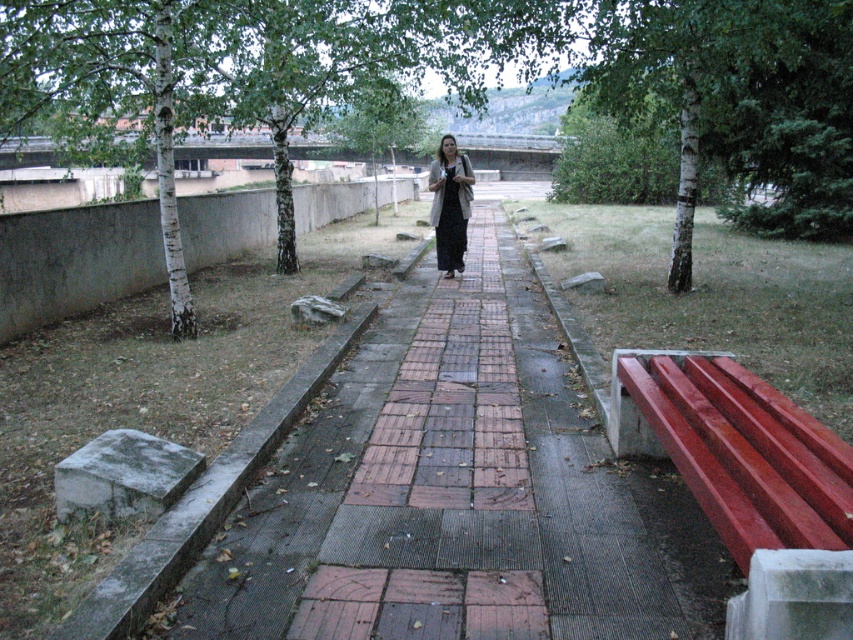
You are standing on the paved pathway and see the smooth red bench at right and the dark gray fabric dress at center. Which object is positioned lower in the image?

The smooth red bench at right is located below the dark gray fabric dress at center, so it is positioned lower in the image.

You are standing at the red bench with a white concrete base at the bottom right corner of the scene. You want to walk towards the grassy area on the left side of the path. Which point, point [489,493] or point [459,168], is closer to you as you start walking?

Point [489,493] is closer to the camera than point [459,168], so as you start walking from the red bench with a white concrete base at the bottom right corner towards the grassy area, point [489,493] will be closer to you initially.

You are designing a garden layout and need to place a new flower bed along the brick paved walkway at center. Considering the smooth red bench at right is already there, can you determine if the walkway is wide enough to accommodate a 2 meter wide flower bed on its left side?

The brick paved walkway at center is wider than the smooth red bench at right. Since the bench is on the right side, the walkway has enough space on its left side to accommodate a 2 meter wide flower bed.